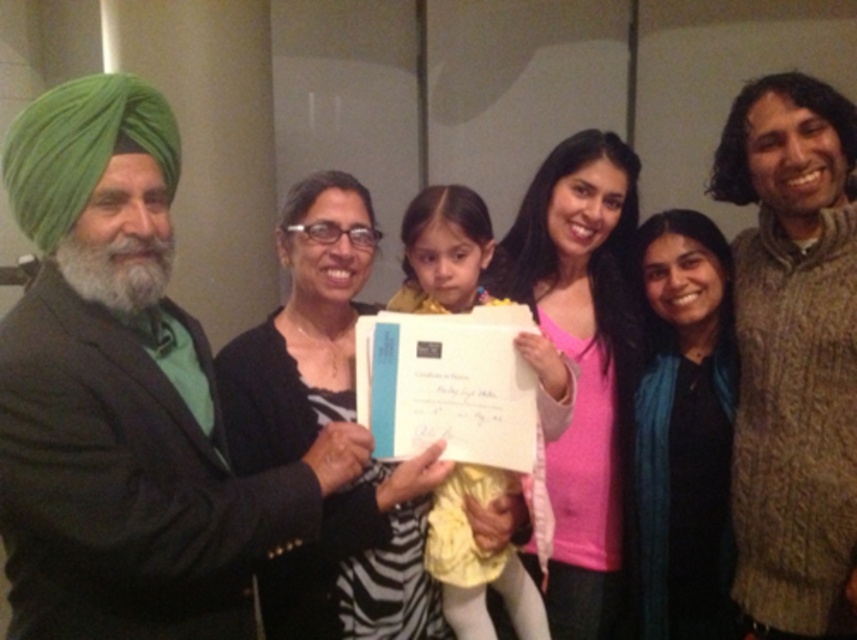
You are a photographer at the event and want to ensure both the knitted beige sweater at right and the black matte scarf at center are visible in the photo. Which one should you focus on to ensure the larger object is properly framed?

The knitted beige sweater at right is larger than the black matte scarf at center, so focusing on it will ensure proper framing for the larger object.

In the scene shown: What is the color of the object located at point coordinates (793, 355)?

The point at coordinates (793, 355) is on a knitted beige sweater at right.

You are a photographer trying to capture a closeup of the pink matte sweater at center and the black matte scarf at center. Which one is closer to the camera?

The pink matte sweater at center is much taller than the black matte scarf at center, so it is closer to the camera.